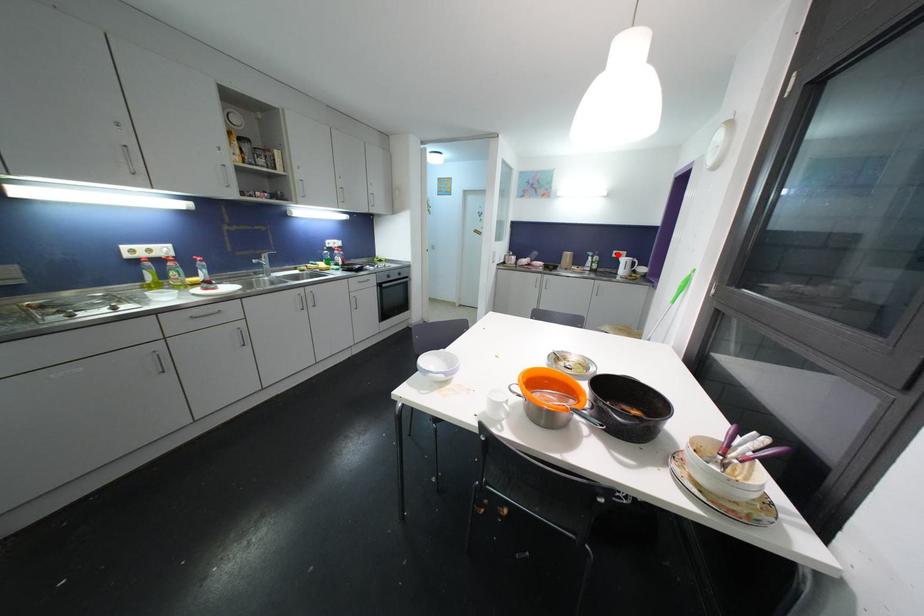
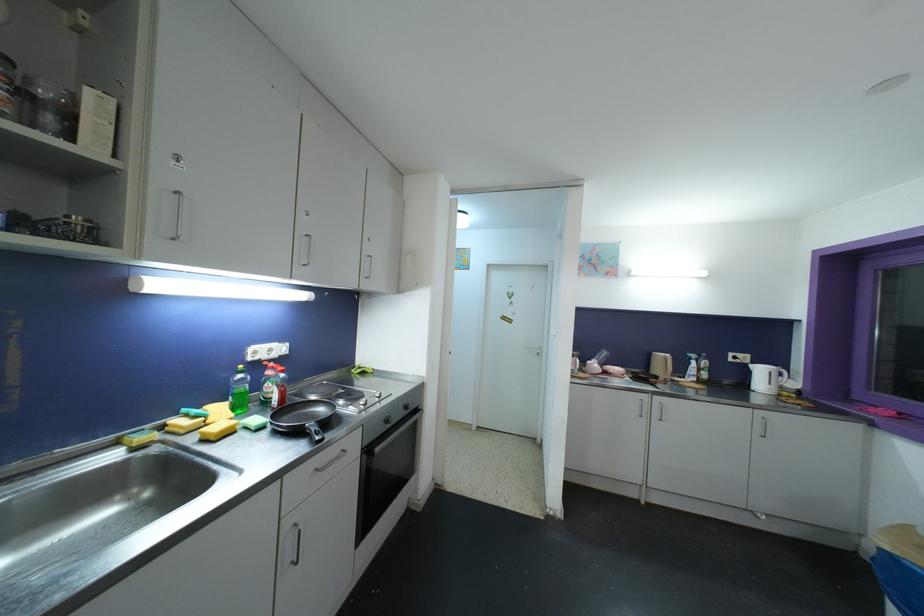
In the second image, find the point that corresponds to the highlighted location in the first image.

(734, 357)